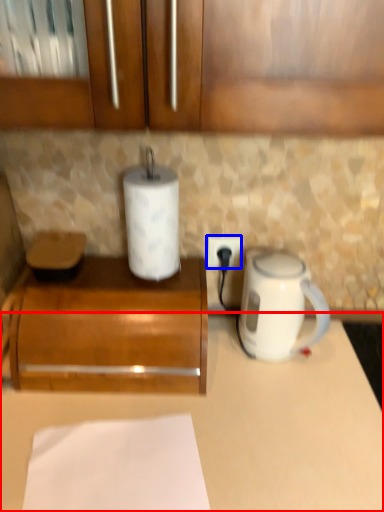
Question: Which object is further to the camera taking this photo, counter (highlighted by a red box) or power outlet (highlighted by a blue box)?

Choices:
 (A) counter
 (B) power outlet

Answer: (B)